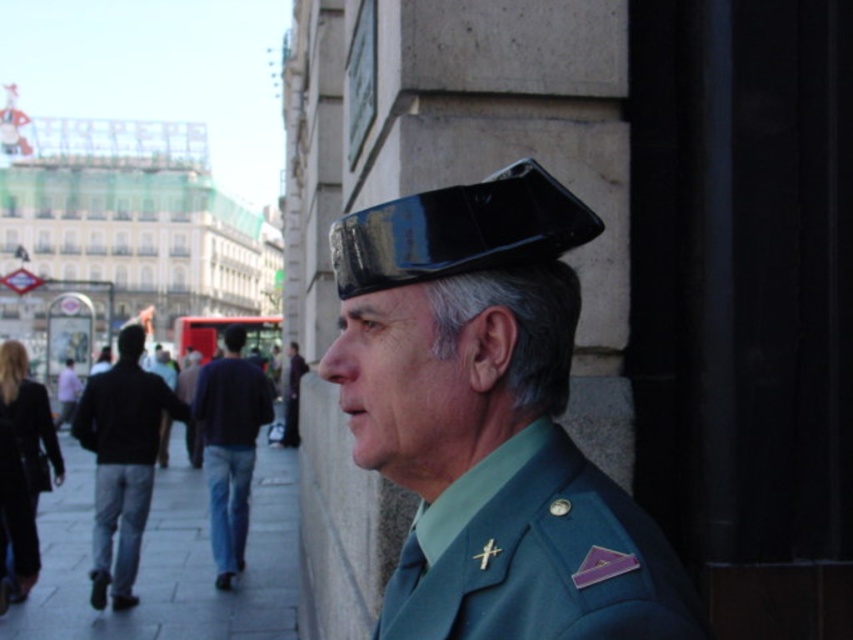
Question: Which of the following is the closest to the observer?

Choices:
 (A) gray concrete pavement at lower left
 (B) blue jeans at lower left
 (C) black matte jacket at left
 (D) green uniform at center

Answer: (A)

Question: Which of the following is the farthest from the observer?

Choices:
 (A) teal fabric uniform at center
 (B) green uniform at center
 (C) glossy black beret at center

Answer: (B)

Question: Can you confirm if gray concrete pavement at lower left is positioned to the left of black matte uniform at lower left?

Choices:
 (A) yes
 (B) no

Answer: (A)

Question: Does glossy black beret at center lie behind blue jeans at lower left?

Choices:
 (A) no
 (B) yes

Answer: (A)

Question: Which object appears farthest from the camera in this image?

Choices:
 (A) black matte uniform at lower left
 (B) black glossy hat at upper center
 (C) blue jeans at lower left
 (D) gray concrete pavement at lower left

Answer: (C)

Question: Can you confirm if black glossy hat at upper center is positioned below black matte uniform at lower left?

Choices:
 (A) no
 (B) yes

Answer: (A)